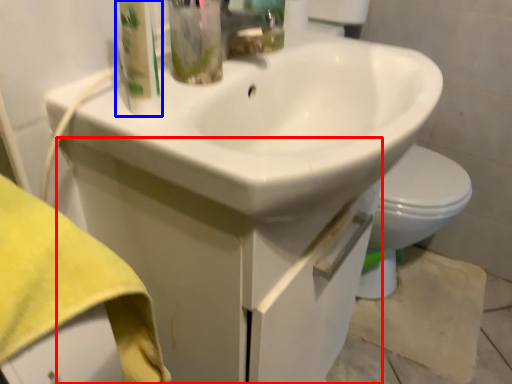
Question: Which of the following is the closest to the observer, drawer (highlighted by a red box) or cleaning product (highlighted by a blue box)?

Choices:
 (A) drawer
 (B) cleaning product

Answer: (B)